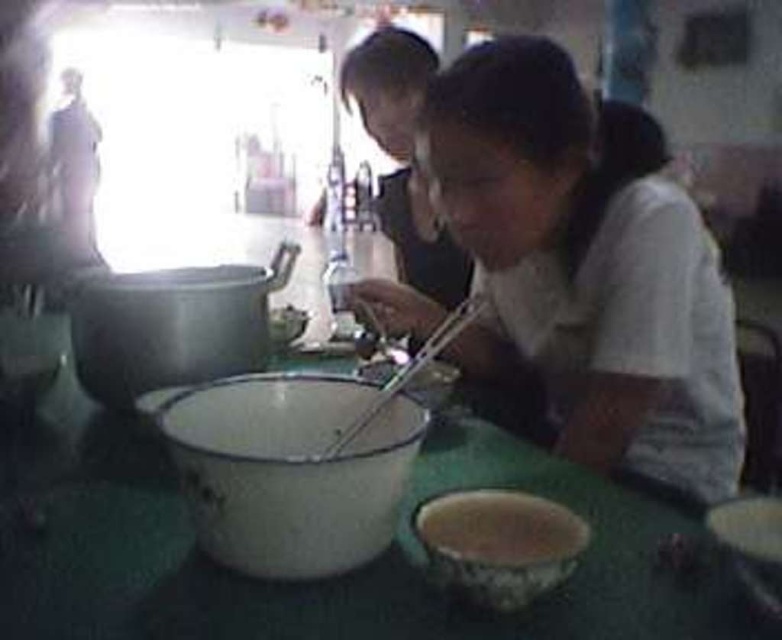
Question: Which object appears farthest from the camera in this image?

Choices:
 (A) metallic silver chopsticks at center
 (B) matte white mixing bowl at center

Answer: (B)

Question: Can you confirm if white matte shirt at center is positioned to the right of porcelain bowl at lower center?

Choices:
 (A) no
 (B) yes

Answer: (B)

Question: Based on their relative distances, which object is farther from the porcelain bowl at lower center?

Choices:
 (A) white matte shirt at center
 (B) metallic silver chopsticks at center

Answer: (A)

Question: Is the position of white enamel mixing bowl at center less distant than that of metallic silver chopsticks at center?

Choices:
 (A) no
 (B) yes

Answer: (B)

Question: Which point is closer to the camera?

Choices:
 (A) (482, 528)
 (B) (278, 529)
 (C) (131, 392)
 (D) (565, 109)

Answer: (B)

Question: From the image, what is the correct spatial relationship of white matte shirt at center in relation to matte white mixing bowl at center?

Choices:
 (A) below
 (B) above

Answer: (B)